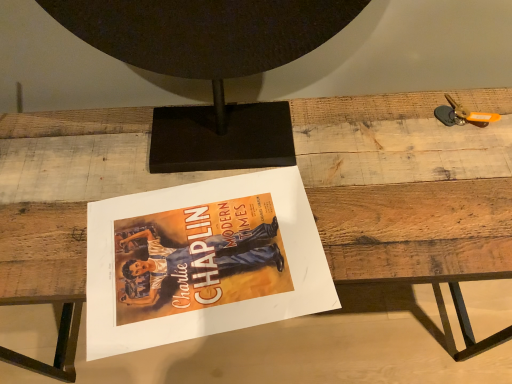
This screenshot has height=384, width=512. In order to click on free location in front of matte black round table at center in this screenshot , I will do `click(231, 236)`.